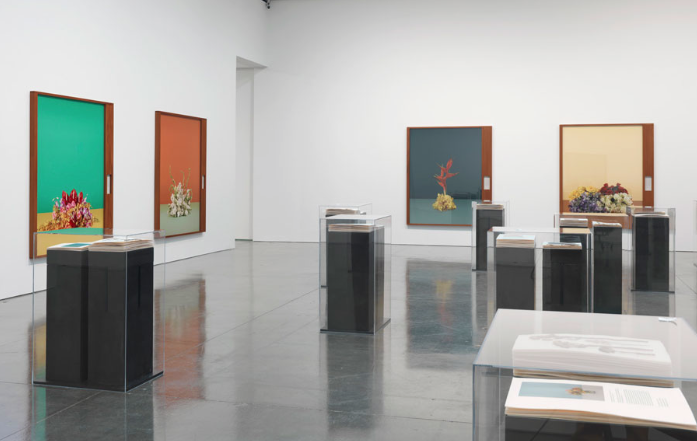
Find the location of a particular element. wall is located at coordinates (139, 155).